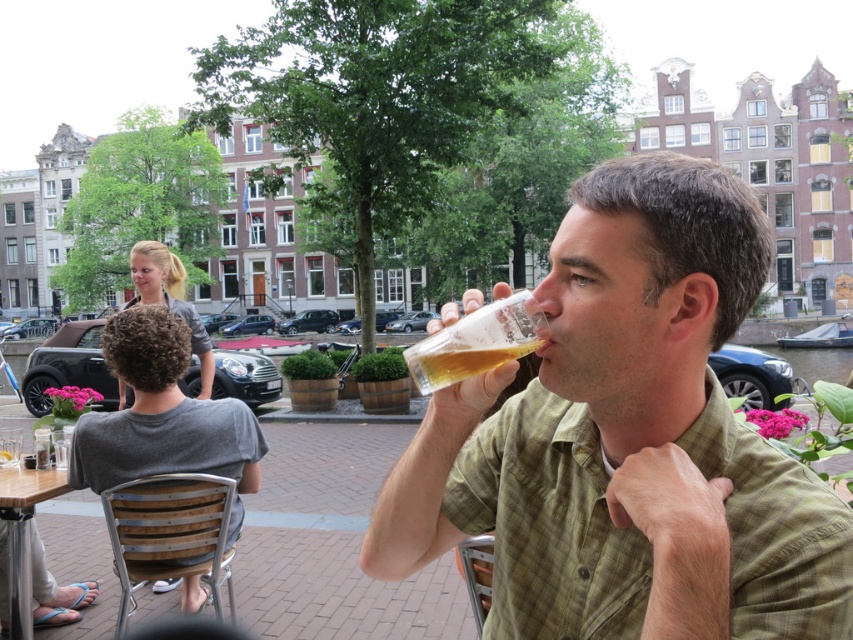
Does point (679, 515) lie behind point (32, 596)?

No, (679, 515) is in front of (32, 596).

Is matte green shirt at center wider than wooden table at lower left?

Yes, matte green shirt at center is wider than wooden table at lower left.

What are the coordinates of `matte green shirt at center` in the screenshot? It's located at (628, 440).

This screenshot has width=853, height=640. What are the coordinates of `matte green shirt at center` in the screenshot? It's located at (628, 440).

Is wooden table at lower left thinner than translucent plastic glass at upper center?

Correct, wooden table at lower left's width is less than translucent plastic glass at upper center's.

Which of these two, wooden table at lower left or translucent plastic glass at upper center, stands taller?

Standing taller between the two is wooden table at lower left.

Does point (45, 488) come closer to viewer compared to point (473, 321)?

No, (45, 488) is further to viewer.

Identify the location of wooden table at lower left. (32, 554).

Can you confirm if wooden table at lower left is thinner than translucent glass at upper center?

Indeed, wooden table at lower left has a lesser width compared to translucent glass at upper center.

Is wooden table at lower left to the right of translucent glass at upper center from the viewer's perspective?

Incorrect, wooden table at lower left is not on the right side of translucent glass at upper center.

Does point (4, 624) come behind point (422, 390)?

That is True.

Where is `wooden table at lower left`? Image resolution: width=853 pixels, height=640 pixels. wooden table at lower left is located at coordinates (32, 554).